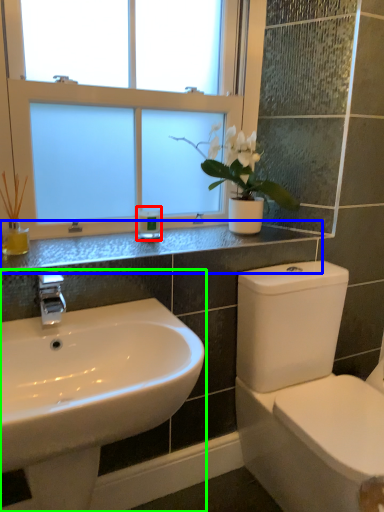
Question: Based on their relative distances, which object is farther from toiletry (highlighted by a red box)? Choose from counter top (highlighted by a blue box) and sink (highlighted by a green box).

Choices:
 (A) counter top
 (B) sink

Answer: (B)